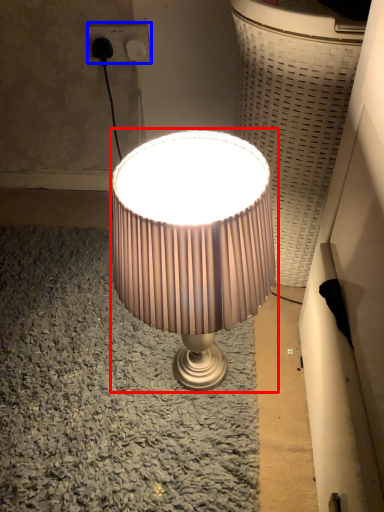
Question: Among these objects, which one is nearest to the camera, lamp (highlighted by a red box) or electric outlet (highlighted by a blue box)?

Choices:
 (A) lamp
 (B) electric outlet

Answer: (A)